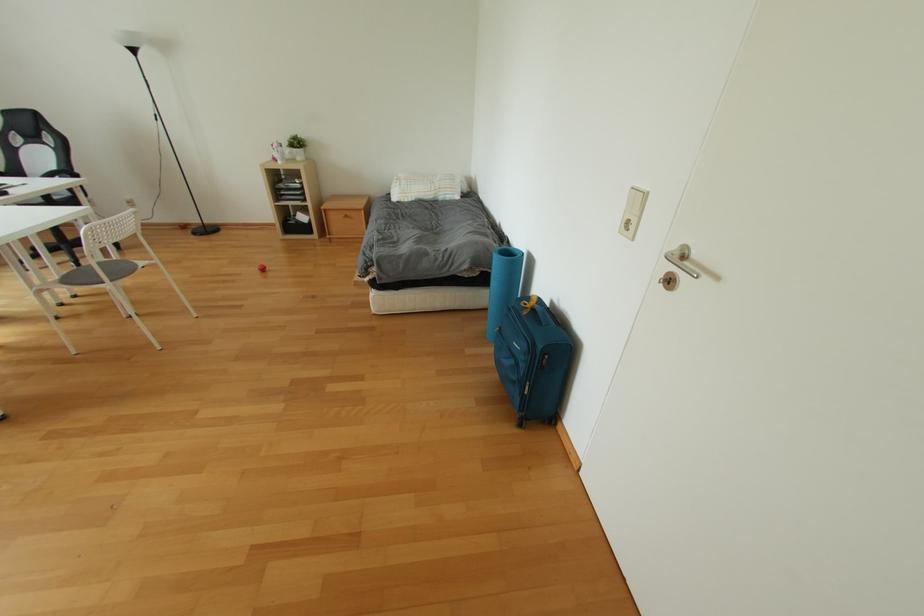
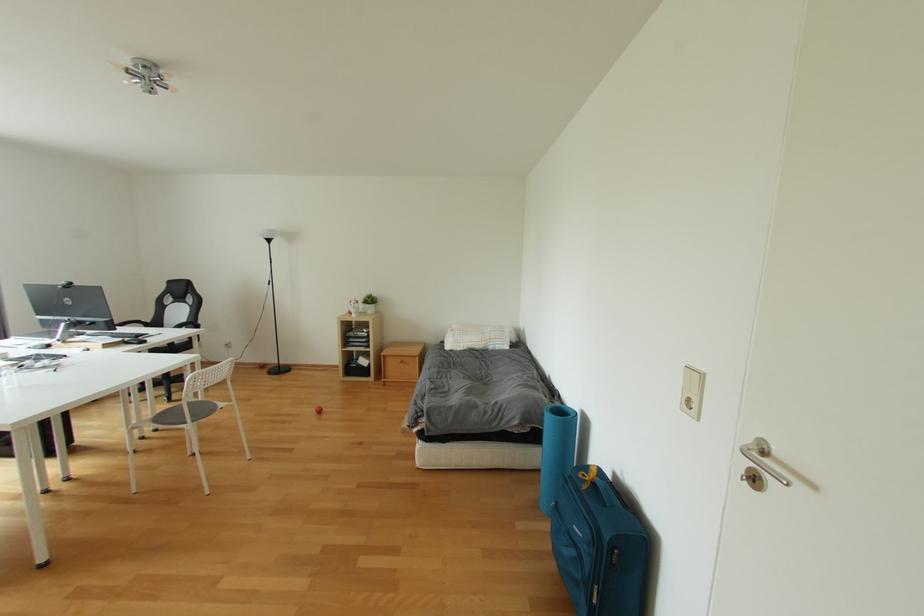
Question: The images are taken continuously from a first-person perspective. In which direction is your viewpoint rotating?

Choices:
 (A) Left
 (B) Right
 (C) Up
 (D) Down

Answer: (C)